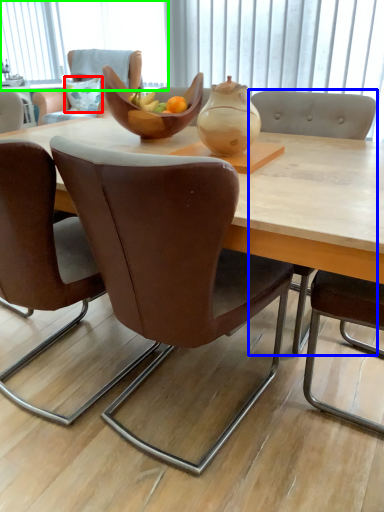
Question: Based on their relative distances, which object is nearer to pillow (highlighted by a red box)? Choose from chair (highlighted by a blue box) and window screen (highlighted by a green box).

Choices:
 (A) chair
 (B) window screen

Answer: (B)